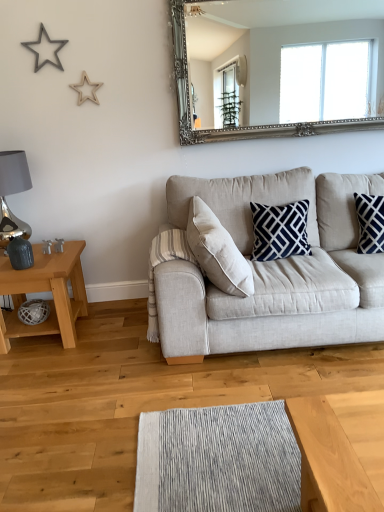
This screenshot has width=384, height=512. I want to click on free space in front of matte wooden table at left, so click(x=46, y=377).